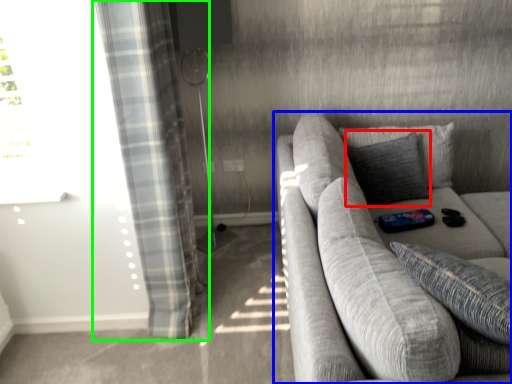
Question: Which object is the closest to the pillow (highlighted by a red box)? Choose among these: studio couch (highlighted by a blue box) or curtain (highlighted by a green box).

Choices:
 (A) studio couch
 (B) curtain

Answer: (A)